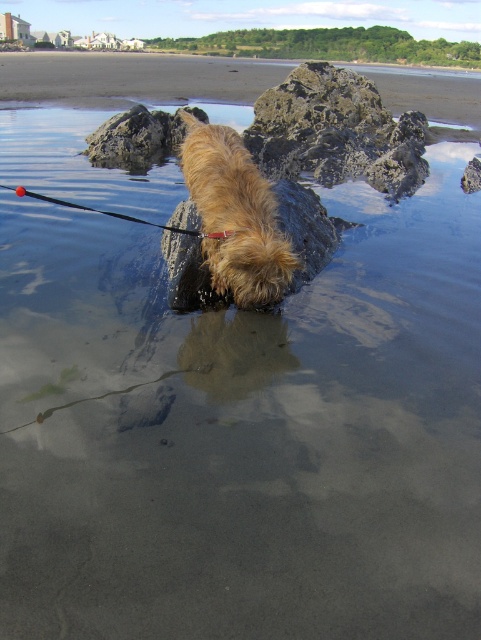
Question: Which of the following is the farthest from the observer?

Choices:
 (A) (191, 77)
 (B) (202, 179)

Answer: (A)

Question: Does smooth sand beach at center have a larger size compared to fuzzy brown dog at center?

Choices:
 (A) yes
 (B) no

Answer: (A)

Question: Among these points, which one is nearest to the camera?

Choices:
 (A) (248, 170)
 (B) (477, 132)

Answer: (A)

Question: Does smooth sand beach at center appear over fuzzy brown dog at center?

Choices:
 (A) yes
 (B) no

Answer: (A)

Question: Is smooth sand beach at center thinner than fuzzy brown dog at center?

Choices:
 (A) no
 (B) yes

Answer: (A)